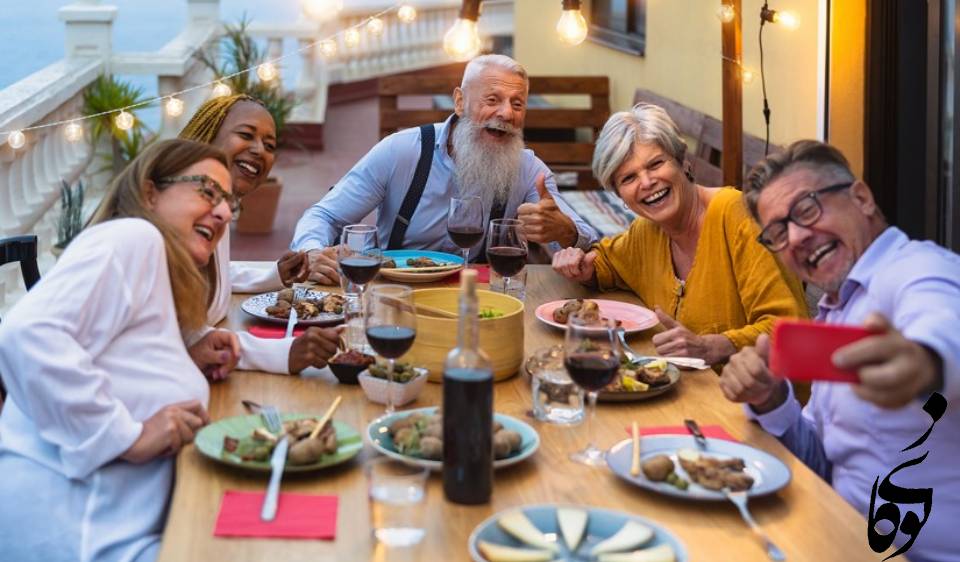
Where is `glasses of wine`? glasses of wine is located at coordinates (360, 261), (396, 347), (461, 231), (507, 253), (588, 361).